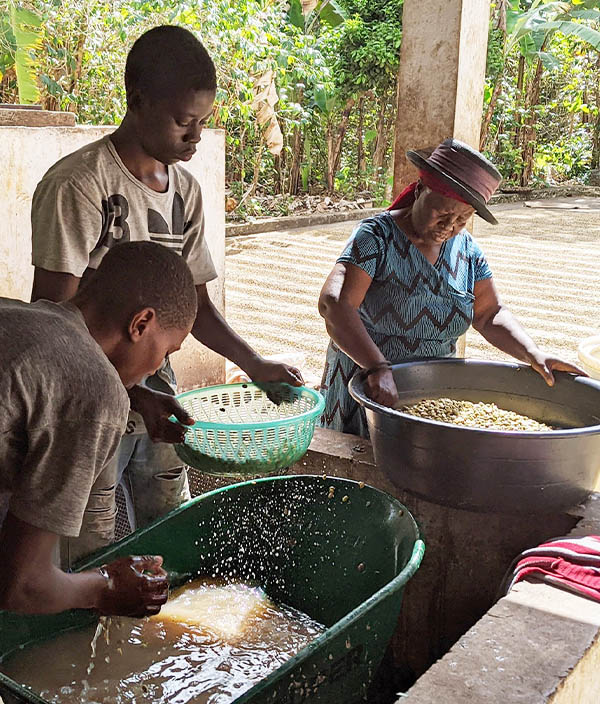
This screenshot has width=600, height=704. What are the coordinates of `green tub` in the screenshot? It's located at [x=405, y=572], [x=355, y=657], [x=171, y=514], [x=30, y=691], [x=12, y=629].